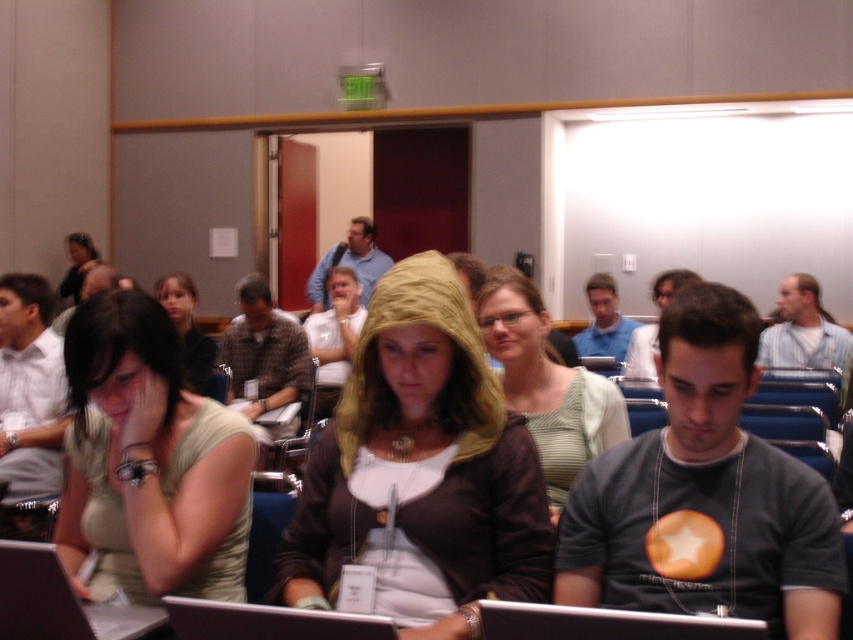
Measure the distance between matte gold hoodie at center and green matte shirt at center.

matte gold hoodie at center is 14.20 inches away from green matte shirt at center.

From the picture: Measure the distance between point (431, 497) and camera.

Point (431, 497) is 4.65 feet away from camera.

Is point (529, 477) behind point (219, 413)?

No.

Find the location of a particular element. matte gold hoodie at center is located at coordinates (422, 467).

Does matte gold hoodie at center have a lesser height compared to green striped shirt at center?

In fact, matte gold hoodie at center may be taller than green striped shirt at center.

Can you confirm if matte gold hoodie at center is positioned below green striped shirt at center?

Correct, matte gold hoodie at center is located below green striped shirt at center.

Where is `matte gold hoodie at center`? matte gold hoodie at center is located at coordinates (422, 467).

Who is higher up, green striped shirt at center or matte black hoodie at center?

matte black hoodie at center is above.

Where is `green striped shirt at center`? This screenshot has height=640, width=853. green striped shirt at center is located at coordinates (546, 385).

Who is more distant from viewer, (537, 316) or (201, 368)?

The point (201, 368) is behind.

Where is `green striped shirt at center`? Image resolution: width=853 pixels, height=640 pixels. green striped shirt at center is located at coordinates (546, 385).